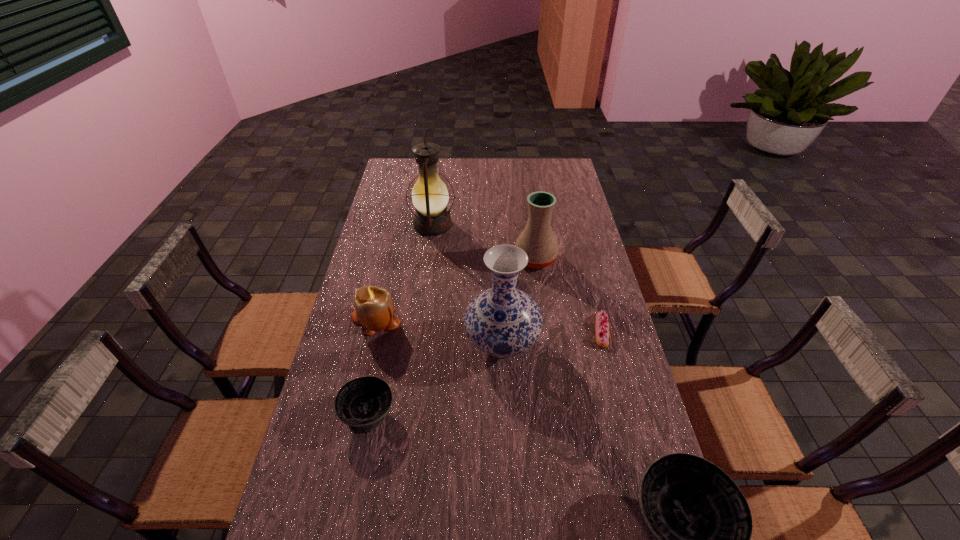
In order to click on the sixth farthest object in this screenshot , I will do `click(362, 403)`.

At what (x,y) coordinates should I click in order to perform the action: click on the shorter bowl. Please return your answer as a coordinate pair (x, y). Looking at the image, I should click on (362, 403).

Where is `oil lamp`? The image size is (960, 540). oil lamp is located at coordinates (430, 197).

You are a GUI agent. You are given a task and a screenshot of the screen. Output one action in this format:
    pyautogui.click(x=<x>, y=<y>)
    Task: Click on the fifth shortest object
    This screenshot has height=540, width=960.
    Given the screenshot: What is the action you would take?
    pyautogui.click(x=537, y=239)

The height and width of the screenshot is (540, 960). Find the location of `pottery`. pottery is located at coordinates [537, 239].

Locate an element on the screen. The width and height of the screenshot is (960, 540). eclair is located at coordinates (602, 334).

This screenshot has width=960, height=540. Identify the location of vase. (503, 321).

What are the coordinates of `candle` in the screenshot? It's located at (374, 309).

Locate an element on the screen. free location located 0.160m on the back of the sixth farthest object is located at coordinates (382, 345).

Identify the location of vacant space located on the left of the farthest object. (383, 225).